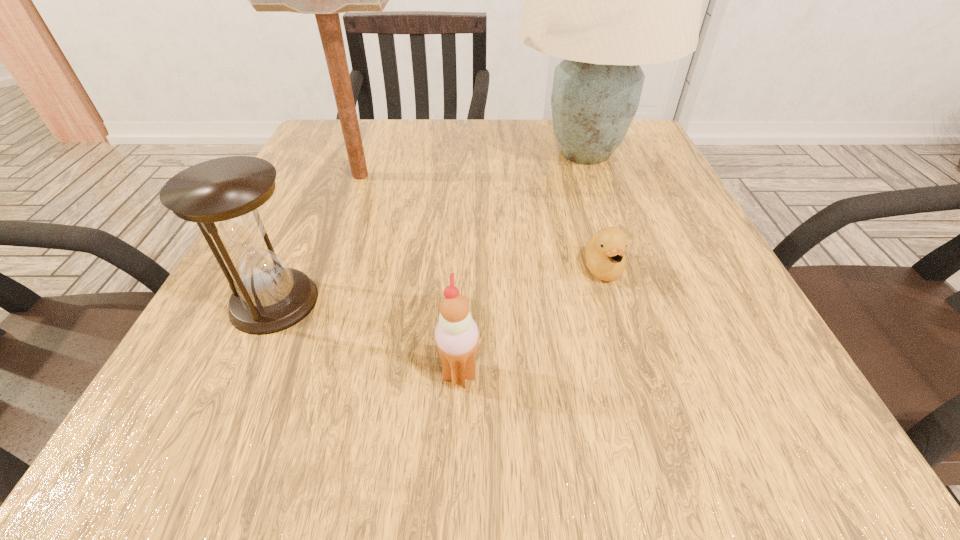
The image size is (960, 540). What are the coordinates of `lampshade` in the screenshot? It's located at (606, 0).

Where is `the second tallest object`? the second tallest object is located at coordinates (326, 0).

Locate an element on the screen. The image size is (960, 540). the third shortest object is located at coordinates (226, 197).

Find the location of `icecream`. icecream is located at coordinates (456, 334).

What are the coordinates of `the fourth tallest object` in the screenshot? It's located at (456, 334).

You are a GUI agent. You are given a task and a screenshot of the screen. Output one action in this format:
    pyautogui.click(x=<x>, y=<y>)
    Task: Click on the duckling
    The image size is (960, 540).
    Given the screenshot: What is the action you would take?
    pyautogui.click(x=605, y=258)

Locate an element on the screen. The image size is (960, 540). free space located on the front of the lampshade is located at coordinates (651, 345).

I want to click on vacant space located on the striking face of the fourth shortest object, so click(x=499, y=176).

Image resolution: width=960 pixels, height=540 pixels. In order to click on free region located on the back of the third tallest object in this screenshot , I will do `click(324, 191)`.

The image size is (960, 540). I want to click on free space located at the front with a straw on the second shortest object, so click(x=757, y=375).